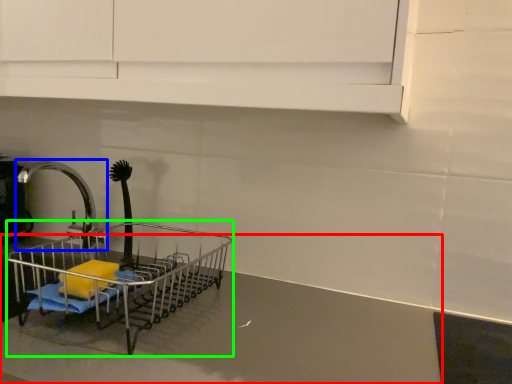
Question: Which object is the farthest from counter top (highlighted by a red box)? Choose among these: tap (highlighted by a blue box) or shopping cart (highlighted by a green box).

Choices:
 (A) tap
 (B) shopping cart

Answer: (A)